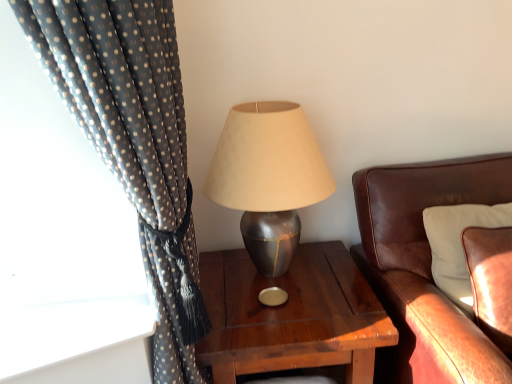
Image resolution: width=512 pixels, height=384 pixels. I want to click on vacant point above wooden nightstand at center (from a real-world perspective), so click(x=280, y=287).